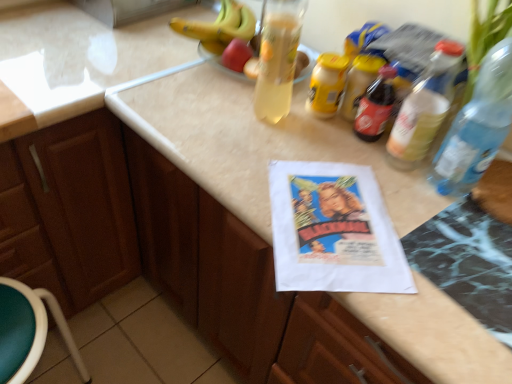
You are a GUI agent. You are given a task and a screenshot of the screen. Output one action in this format:
    pyautogui.click(x=<x>, y=<y>)
    Task: Click on the translucent plastic bottle at upper right, which is the second bottle in right-to-left order
    The height and width of the screenshot is (384, 512).
    Given the screenshot: What is the action you would take?
    pyautogui.click(x=425, y=107)

The image size is (512, 384). Describe the element at coordinates (425, 107) in the screenshot. I see `translucent plastic bottle at upper right, which is the second bottle in right-to-left order` at that location.

The image size is (512, 384). What do you see at coordinates (28, 330) in the screenshot?
I see `green plastic stool at lower left` at bounding box center [28, 330].

What is the approximate width of brown wood cabinet at left?

brown wood cabinet at left is 21.05 inches in width.

What is the approximate height of transparent plastic bottle at right, the second bottle positioned from the left?

13.37 inches.

Identify the location of translucent plastic bottle at upper right, which is the first bottle in left-to-right order. The height and width of the screenshot is (384, 512). click(425, 107).

Can you tell me how much translucent plastic bottle at upper right, which is the second bottle in right-to-left order, and brown wood cabinet at left differ in facing direction?

translucent plastic bottle at upper right, which is the second bottle in right-to-left order, and brown wood cabinet at left are facing 89.8 degrees away from each other.

You are a GUI agent. You are given a task and a screenshot of the screen. Output one action in this format:
    pyautogui.click(x=<x>, y=<y>)
    Task: Click on the 1st bottle above the brown wood cabinet at left (from a real-world perspective)
    This screenshot has width=512, height=384.
    Given the screenshot: What is the action you would take?
    pyautogui.click(x=425, y=107)

Is translucent plastic bottle at upper right, which is the first bottle in left-to-right order, far from brown wood cabinet at left?

That's not correct — translucent plastic bottle at upper right, which is the first bottle in left-to-right order, is a little close to brown wood cabinet at left.

You are a GUI agent. You are given a task and a screenshot of the screen. Output one action in this format:
    pyautogui.click(x=<x>, y=<y>)
    Task: Click on the bottle behind the transparent plastic bottle at right, the second bottle positioned from the left
    
    Given the screenshot: What is the action you would take?
    pyautogui.click(x=425, y=107)

Is transparent plastic bottle at right, the 1th bottle when ordered from right to left, in front of translucent plastic bottle at upper right, which is the first bottle in left-to-right order?

Yes, transparent plastic bottle at right, the 1th bottle when ordered from right to left, is in front of translucent plastic bottle at upper right, which is the first bottle in left-to-right order.

Is transparent plastic bottle at right, the second bottle positioned from the left, aimed at translucent plastic bottle at upper right, which is the second bottle in right-to-left order?

No, transparent plastic bottle at right, the second bottle positioned from the left, is not turned towards translucent plastic bottle at upper right, which is the second bottle in right-to-left order.

Considering the sizes of transparent plastic bottle at right, the 1th bottle when ordered from right to left, and translucent plastic bottle at upper right, which is the first bottle in left-to-right order, in the image, is transparent plastic bottle at right, the 1th bottle when ordered from right to left, wider or thinner than translucent plastic bottle at upper right, which is the first bottle in left-to-right order,?

Considering their sizes, transparent plastic bottle at right, the 1th bottle when ordered from right to left, looks broader than translucent plastic bottle at upper right, which is the first bottle in left-to-right order.

From the image's perspective, is brown wood cabinet at left located beneath translucent plastic bottle at upper right, which is the first bottle in left-to-right order?

Yes.

Is brown wood cabinet at left at the right side of translucent plastic bottle at upper right, which is the first bottle in left-to-right order?

In fact, brown wood cabinet at left is to the left of translucent plastic bottle at upper right, which is the first bottle in left-to-right order.

Which object is further away from the camera taking this photo, brown wood cabinet at left or translucent plastic bottle at upper right, which is the second bottle in right-to-left order?

Positioned behind is brown wood cabinet at left.

How much distance is there between brown wood cabinet at left and translucent plastic bottle at upper right, which is the first bottle in left-to-right order?

brown wood cabinet at left and translucent plastic bottle at upper right, which is the first bottle in left-to-right order, are 80.16 centimeters apart.

Based on the photo, is green plastic stool at lower left inside the boundaries of translucent plastic bottle at upper right, which is the first bottle in left-to-right order, or outside?

green plastic stool at lower left is located beyond the bounds of translucent plastic bottle at upper right, which is the first bottle in left-to-right order.

Which of these two, green plastic stool at lower left or translucent plastic bottle at upper right, which is the first bottle in left-to-right order, stands shorter?

Standing shorter between the two is translucent plastic bottle at upper right, which is the first bottle in left-to-right order.

Which object is more forward, green plastic stool at lower left or translucent plastic bottle at upper right, which is the first bottle in left-to-right order?

translucent plastic bottle at upper right, which is the first bottle in left-to-right order, is in front.

Can you confirm if brown wood cabinet at left is wider than green plastic stool at lower left?

Correct, the width of brown wood cabinet at left exceeds that of green plastic stool at lower left.

From the image's perspective, is brown wood cabinet at left above green plastic stool at lower left?

Indeed, from the image's perspective, brown wood cabinet at left is shown above green plastic stool at lower left.

Does brown wood cabinet at left have a larger size compared to green plastic stool at lower left?

Yes.

Do you think brown wood cabinet at left is within green plastic stool at lower left, or outside of it?

brown wood cabinet at left is spatially situated outside green plastic stool at lower left.

How far apart are translucent plastic bottle at upper right, which is the second bottle in right-to-left order, and transparent plastic bottle at right, the second bottle positioned from the left?

A distance of 3.56 inches exists between translucent plastic bottle at upper right, which is the second bottle in right-to-left order, and transparent plastic bottle at right, the second bottle positioned from the left.

Is translucent plastic bottle at upper right, which is the first bottle in left-to-right order, at the left side of transparent plastic bottle at right, the second bottle positioned from the left?

Yes.

Based on the photo, is transparent plastic bottle at right, the second bottle positioned from the left, a part of translucent plastic bottle at upper right, which is the first bottle in left-to-right order?

No.

Between translucent plastic bottle at upper right, which is the second bottle in right-to-left order, and transparent plastic bottle at right, the 1th bottle when ordered from right to left, which one has smaller width?

translucent plastic bottle at upper right, which is the second bottle in right-to-left order.

Considering the sizes of transparent plastic bottle at right, the second bottle positioned from the left, and green plastic stool at lower left in the image, is transparent plastic bottle at right, the second bottle positioned from the left, wider or thinner than green plastic stool at lower left?

In the image, transparent plastic bottle at right, the second bottle positioned from the left, appears to be more narrow than green plastic stool at lower left.

Between transparent plastic bottle at right, the 1th bottle when ordered from right to left, and green plastic stool at lower left, which one is positioned behind?

green plastic stool at lower left is behind.

Is transparent plastic bottle at right, the second bottle positioned from the left, at the right side of green plastic stool at lower left?

Indeed, transparent plastic bottle at right, the second bottle positioned from the left, is positioned on the right side of green plastic stool at lower left.

Is transparent plastic bottle at right, the second bottle positioned from the left, oriented away from green plastic stool at lower left?

No, transparent plastic bottle at right, the second bottle positioned from the left, is not facing the opposite direction of green plastic stool at lower left.

At what (x,y) coordinates should I click in order to perform the action: click on the 2nd bottle above the brown wood cabinet at left (from the image's perspective). Please return your answer as a coordinate pair (x, y). Looking at the image, I should click on (425, 107).

Where is `bottle on the left of transparent plastic bottle at right, the second bottle positioned from the left`? bottle on the left of transparent plastic bottle at right, the second bottle positioned from the left is located at coordinates (425, 107).

Based on the photo, when comparing their distances from transparent plastic bottle at right, the second bottle positioned from the left, does green plastic stool at lower left or brown wood cabinet at left seem further?

green plastic stool at lower left is further to transparent plastic bottle at right, the second bottle positioned from the left.

Considering their positions, is transparent plastic bottle at right, the 1th bottle when ordered from right to left, positioned further to brown wood cabinet at left than green plastic stool at lower left?

transparent plastic bottle at right, the 1th bottle when ordered from right to left, is further to brown wood cabinet at left.

From the image, which object appears to be nearer to green plastic stool at lower left, translucent plastic bottle at upper right, which is the second bottle in right-to-left order, or brown wood cabinet at left?

brown wood cabinet at left lies closer to green plastic stool at lower left than the other object.

Estimate the real-world distances between objects in this image. Which object is closer to translucent plastic bottle at upper right, which is the second bottle in right-to-left order, green plastic stool at lower left or brown wood cabinet at left?

brown wood cabinet at left lies closer to translucent plastic bottle at upper right, which is the second bottle in right-to-left order, than the other object.

From the picture: Looking at the image, which one is located closer to translucent plastic bottle at upper right, which is the first bottle in left-to-right order, transparent plastic bottle at right, the 1th bottle when ordered from right to left, or brown wood cabinet at left?

transparent plastic bottle at right, the 1th bottle when ordered from right to left, is closer to translucent plastic bottle at upper right, which is the first bottle in left-to-right order.

From the image, which object appears to be nearer to translucent plastic bottle at upper right, which is the second bottle in right-to-left order, brown wood cabinet at left or green plastic stool at lower left?

brown wood cabinet at left is positioned closer to the anchor translucent plastic bottle at upper right, which is the second bottle in right-to-left order.

From the image, which object appears to be farther from brown wood cabinet at left, transparent plastic bottle at right, the 1th bottle when ordered from right to left, or translucent plastic bottle at upper right, which is the second bottle in right-to-left order?

transparent plastic bottle at right, the 1th bottle when ordered from right to left, is further to brown wood cabinet at left.

When comparing their distances from transparent plastic bottle at right, the second bottle positioned from the left, does translucent plastic bottle at upper right, which is the first bottle in left-to-right order, or brown wood cabinet at left seem closer?

Based on the image, translucent plastic bottle at upper right, which is the first bottle in left-to-right order, appears to be nearer to transparent plastic bottle at right, the second bottle positioned from the left.

You are a GUI agent. You are given a task and a screenshot of the screen. Output one action in this format:
    pyautogui.click(x=<x>, y=<y>)
    Task: Click on the bar stool located between brown wood cabinet at left and translucent plastic bottle at upper right, which is the second bottle in right-to-left order, in the left-right direction
    
    Given the screenshot: What is the action you would take?
    pyautogui.click(x=28, y=330)

The image size is (512, 384). Find the location of `bar stool between brown wood cabinet at left and transparent plastic bottle at right, the second bottle positioned from the left, in the horizontal direction`. bar stool between brown wood cabinet at left and transparent plastic bottle at right, the second bottle positioned from the left, in the horizontal direction is located at coordinates (28, 330).

Identify the location of bottle situated between green plastic stool at lower left and transparent plastic bottle at right, the second bottle positioned from the left, from left to right. The width and height of the screenshot is (512, 384). (425, 107).

Locate an element on the screen. bottle between brown wood cabinet at left and transparent plastic bottle at right, the 1th bottle when ordered from right to left, from left to right is located at coordinates (425, 107).